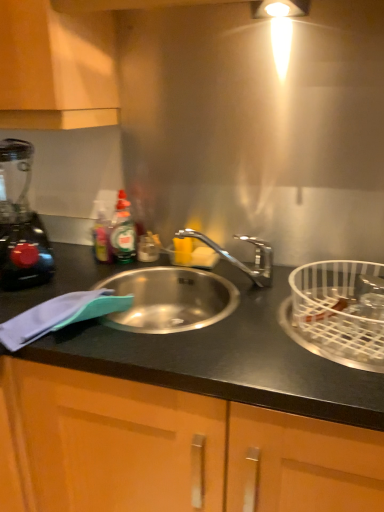
Question: In terms of height, does black matte countertop at left look taller or shorter compared to black plastic blender at left?

Choices:
 (A) tall
 (B) short

Answer: (A)

Question: Considering their positions, is black matte countertop at left located in front of or behind black plastic blender at left?

Choices:
 (A) behind
 (B) front

Answer: (B)

Question: Estimate the real-world distances between objects in this image. Which object is closer to the white wire basket at right?

Choices:
 (A) matte wood cabinet at upper left
 (B) black plastic blender at left
 (C) black matte countertop at left

Answer: (C)

Question: Which of these objects is positioned farthest from the black plastic blender at left?

Choices:
 (A) white wire basket at right
 (B) matte wood cabinet at upper left
 (C) black matte countertop at left

Answer: (A)